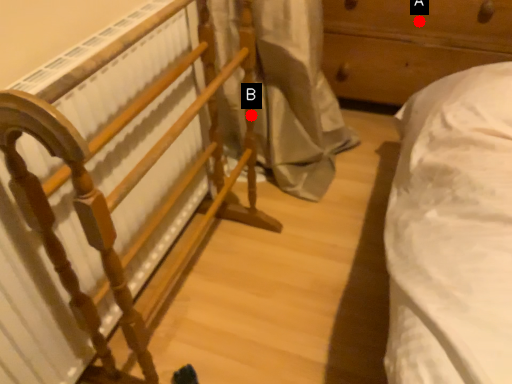
Question: Two points are circled on the image, labeled by A and B beside each circle. Which point is further to the camera?

Choices:
 (A) A is further
 (B) B is further

Answer: (A)